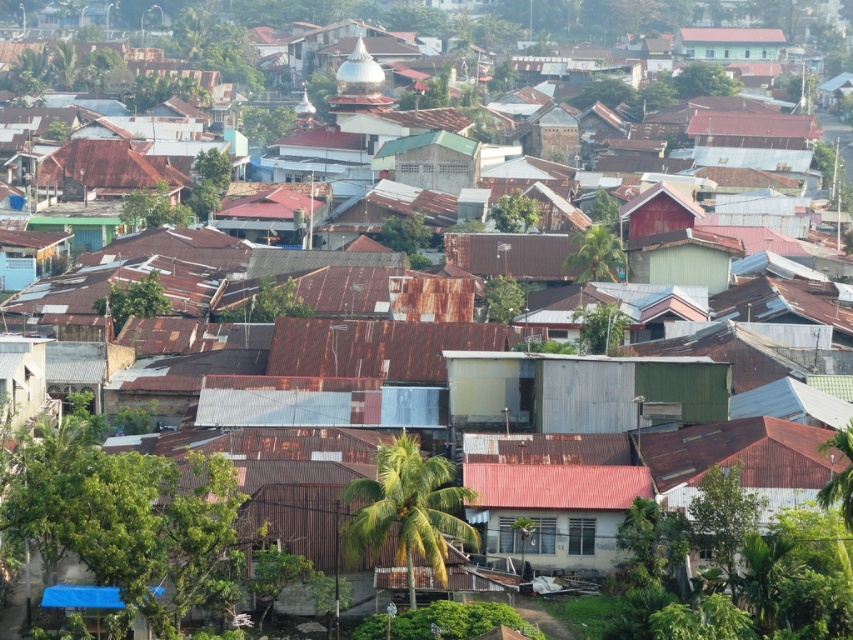
You are a delivery drone navigating an urban area. Your destination is the green corrugated metal hut at center. According to the coordinates provided, where should you aim your delivery? Please specify the coordinates in the format requested.

The green corrugated metal hut at center is located at point (582,390), so you should aim your delivery at those coordinates.

You are a delivery drone flying over an urban area. You need to deliver a package to the green corrugated metal hut at center. There is a rusty metal hut at upper left in your way. Which direction should you adjust your flight path to avoid it?

The green corrugated metal hut at center is to the right of the rusty metal hut at upper left, so you should adjust your flight path to the left to avoid the rusty metal hut at upper left and reach the green corrugated metal hut at center.

You are a delivery drone with a wingspan of 1.2 meters. You need to fly between the rusty metal hut at upper left and the green corrugated metal building at upper center. Can you safely pass through the space between them without hitting either structure?

The rusty metal hut at upper left and the green corrugated metal building at upper center are 135.78 meters apart. Since the distance between them is much greater than the drone wingspan of 1.2 meters, the drone can safely pass through the space between them without any collision risk.